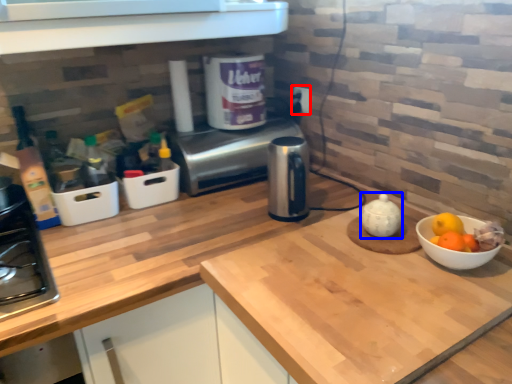
Question: Which object appears farthest to the camera in this image, electric outlet (highlighted by a red box) or tea pot (highlighted by a blue box)?

Choices:
 (A) electric outlet
 (B) tea pot

Answer: (A)